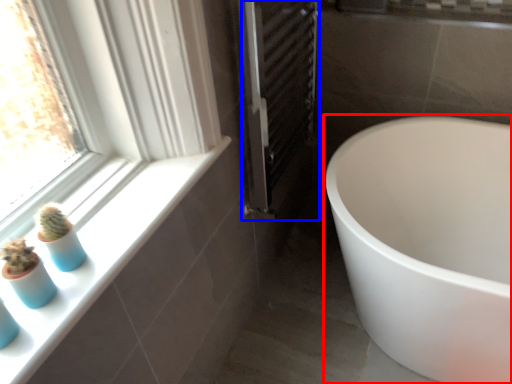
Question: Which object appears closest to the camera in this image, bathtub (highlighted by a red box) or screen door (highlighted by a blue box)?

Choices:
 (A) bathtub
 (B) screen door

Answer: (A)